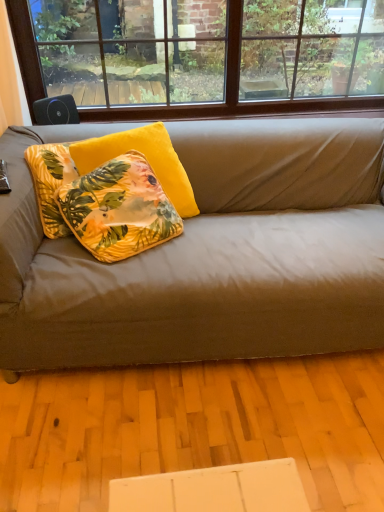
Identify the location of yellow velvet pillow at center, placed as the 2th pillow when sorted from front to back. The height and width of the screenshot is (512, 384). (146, 158).

Where is `yellow velvet pillow at center, placed as the 2th pillow when sorted from front to back`? The width and height of the screenshot is (384, 512). yellow velvet pillow at center, placed as the 2th pillow when sorted from front to back is located at coordinates (146, 158).

Can we say matte gray couch at center lies outside floral yellow pillow at center, which ranks as the 1th pillow in front-to-back order?

Yes, matte gray couch at center is located beyond the bounds of floral yellow pillow at center, which ranks as the 1th pillow in front-to-back order.

Can you confirm if matte gray couch at center is shorter than floral yellow pillow at center, which ranks as the 1th pillow in front-to-back order?

In fact, matte gray couch at center may be taller than floral yellow pillow at center, which ranks as the 1th pillow in front-to-back order.

Based on their positions, is matte gray couch at center located to the left or right of floral yellow pillow at center, which ranks as the 2th pillow in back-to-front order?

Clearly, matte gray couch at center is on the right of floral yellow pillow at center, which ranks as the 2th pillow in back-to-front order, in the image.

From the image's perspective, is matte gray couch at center located above floral yellow pillow at center, which ranks as the 1th pillow in front-to-back order?

No.

Does floral yellow pillow at center, which ranks as the 1th pillow in front-to-back order, turn towards yellow velvet pillow at center, placed as the 2th pillow when sorted from front to back?

Yes, floral yellow pillow at center, which ranks as the 1th pillow in front-to-back order, is turned towards yellow velvet pillow at center, placed as the 2th pillow when sorted from front to back.

Is floral yellow pillow at center, which ranks as the 1th pillow in front-to-back order, to the left of yellow velvet pillow at center, which is counted as the 1th pillow, starting from the back, from the viewer's perspective?

Yes, floral yellow pillow at center, which ranks as the 1th pillow in front-to-back order, is to the left of yellow velvet pillow at center, which is counted as the 1th pillow, starting from the back.

How many degrees apart are the facing directions of floral yellow pillow at center, which ranks as the 2th pillow in back-to-front order, and yellow velvet pillow at center, which is counted as the 1th pillow, starting from the back?

8.48 degrees.

This screenshot has width=384, height=512. Identify the location of pillow that appears above the floral yellow pillow at center, which ranks as the 1th pillow in front-to-back order (from the image's perspective). (146, 158).

Is brown wood window at upper center surrounding yellow velvet pillow at center, placed as the 2th pillow when sorted from front to back?

No.

Is brown wood window at upper center aimed at yellow velvet pillow at center, placed as the 2th pillow when sorted from front to back?

Yes, brown wood window at upper center is aimed at yellow velvet pillow at center, placed as the 2th pillow when sorted from front to back.

Which object is closer to the camera, brown wood window at upper center or yellow velvet pillow at center, placed as the 2th pillow when sorted from front to back?

yellow velvet pillow at center, placed as the 2th pillow when sorted from front to back, is more forward.

Would you say matte gray couch at center is part of brown wood window at upper center's contents?

No, brown wood window at upper center does not contain matte gray couch at center.

Based on the photo, considering the sizes of objects brown wood window at upper center and matte gray couch at center in the image provided, who is wider, brown wood window at upper center or matte gray couch at center?

matte gray couch at center.

Between point (136, 1) and point (80, 351), which one is positioned behind?

Positioned behind is point (136, 1).

Is brown wood window at upper center turned away from matte gray couch at center?

No, brown wood window at upper center's orientation is not away from matte gray couch at center.

Between yellow velvet pillow at center, placed as the 2th pillow when sorted from front to back, and brown wood window at upper center, which one appears on the left side from the viewer's perspective?

yellow velvet pillow at center, placed as the 2th pillow when sorted from front to back.

Is yellow velvet pillow at center, which is counted as the 1th pillow, starting from the back, not close to brown wood window at upper center?

Yes, yellow velvet pillow at center, which is counted as the 1th pillow, starting from the back, and brown wood window at upper center are quite far apart.

Is yellow velvet pillow at center, which is counted as the 1th pillow, starting from the back, oriented away from brown wood window at upper center?

yellow velvet pillow at center, which is counted as the 1th pillow, starting from the back, does not have its back to brown wood window at upper center.

In the scene shown: From a real-world perspective, is yellow velvet pillow at center, which is counted as the 1th pillow, starting from the back, positioned above or below brown wood window at upper center?

yellow velvet pillow at center, which is counted as the 1th pillow, starting from the back, is below brown wood window at upper center.

Between matte gray couch at center and yellow velvet pillow at center, which is counted as the 1th pillow, starting from the back, which one appears on the right side from the viewer's perspective?

Positioned to the right is matte gray couch at center.

Considering the relative sizes of matte gray couch at center and yellow velvet pillow at center, which is counted as the 1th pillow, starting from the back, in the image provided, is matte gray couch at center taller than yellow velvet pillow at center, which is counted as the 1th pillow, starting from the back,?

Correct, matte gray couch at center is much taller as yellow velvet pillow at center, which is counted as the 1th pillow, starting from the back.

Is matte gray couch at center further to the viewer compared to yellow velvet pillow at center, placed as the 2th pillow when sorted from front to back?

No, matte gray couch at center is in front of yellow velvet pillow at center, placed as the 2th pillow when sorted from front to back.

From a real-world perspective, who is located higher, matte gray couch at center or yellow velvet pillow at center, placed as the 2th pillow when sorted from front to back?

From a 3D spatial view, yellow velvet pillow at center, placed as the 2th pillow when sorted from front to back, is above.

Measure the distance from brown wood window at upper center to floral yellow pillow at center, which ranks as the 1th pillow in front-to-back order.

brown wood window at upper center is 6.20 feet away from floral yellow pillow at center, which ranks as the 1th pillow in front-to-back order.

Is point (264, 20) farther from viewer compared to point (151, 211)?

Yes, point (264, 20) is farther from viewer.

Consider the image. Which is more to the right, brown wood window at upper center or floral yellow pillow at center, which ranks as the 1th pillow in front-to-back order?

From the viewer's perspective, brown wood window at upper center appears more on the right side.

In terms of width, does brown wood window at upper center look wider or thinner when compared to floral yellow pillow at center, which ranks as the 2th pillow in back-to-front order?

Considering their sizes, brown wood window at upper center looks slimmer than floral yellow pillow at center, which ranks as the 2th pillow in back-to-front order.

You are a GUI agent. You are given a task and a screenshot of the screen. Output one action in this format:
    pyautogui.click(x=<x>, y=<y>)
    Task: Click on the studio couch on the right of floral yellow pillow at center, which ranks as the 1th pillow in front-to-back order
    The image size is (384, 512).
    Given the screenshot: What is the action you would take?
    pyautogui.click(x=212, y=255)

Locate an element on the screen. pillow above the floral yellow pillow at center, which ranks as the 2th pillow in back-to-front order (from a real-world perspective) is located at coordinates (146, 158).

Considering their positions, is yellow velvet pillow at center, which is counted as the 1th pillow, starting from the back, positioned further to matte gray couch at center than brown wood window at upper center?

brown wood window at upper center lies further to matte gray couch at center than the other object.

From the image, which object appears to be nearer to yellow velvet pillow at center, placed as the 2th pillow when sorted from front to back, floral yellow pillow at center, which ranks as the 2th pillow in back-to-front order, or brown wood window at upper center?

floral yellow pillow at center, which ranks as the 2th pillow in back-to-front order.

From the image, which object appears to be farther from matte gray couch at center, yellow velvet pillow at center, which is counted as the 1th pillow, starting from the back, or floral yellow pillow at center, which ranks as the 2th pillow in back-to-front order?

A: yellow velvet pillow at center, which is counted as the 1th pillow, starting from the back, is positioned further to the anchor matte gray couch at center.

Considering their positions, is matte gray couch at center positioned further to brown wood window at upper center than floral yellow pillow at center, which ranks as the 2th pillow in back-to-front order?

matte gray couch at center lies further to brown wood window at upper center than the other object.

Which object lies further to the anchor point matte gray couch at center, floral yellow pillow at center, which ranks as the 1th pillow in front-to-back order, or brown wood window at upper center?

brown wood window at upper center.

Considering their positions, is floral yellow pillow at center, which ranks as the 1th pillow in front-to-back order, positioned further to matte gray couch at center than yellow velvet pillow at center, which is counted as the 1th pillow, starting from the back?

The object further to matte gray couch at center is yellow velvet pillow at center, which is counted as the 1th pillow, starting from the back.

Estimate the real-world distances between objects in this image. Which object is closer to floral yellow pillow at center, which ranks as the 1th pillow in front-to-back order, brown wood window at upper center or matte gray couch at center?

matte gray couch at center lies closer to floral yellow pillow at center, which ranks as the 1th pillow in front-to-back order, than the other object.

From the image, which object appears to be farther from brown wood window at upper center, matte gray couch at center or yellow velvet pillow at center, placed as the 2th pillow when sorted from front to back?

Among the two, yellow velvet pillow at center, placed as the 2th pillow when sorted from front to back, is located further to brown wood window at upper center.

You are a GUI agent. You are given a task and a screenshot of the screen. Output one action in this format:
    pyautogui.click(x=<x>, y=<y>)
    Task: Click on the pillow between brown wood window at upper center and floral yellow pillow at center, which ranks as the 1th pillow in front-to-back order, vertically
    Image resolution: width=384 pixels, height=512 pixels.
    Given the screenshot: What is the action you would take?
    (146, 158)

Identify the location of pillow situated between floral yellow pillow at center, which ranks as the 2th pillow in back-to-front order, and matte gray couch at center from left to right. The image size is (384, 512). (146, 158).